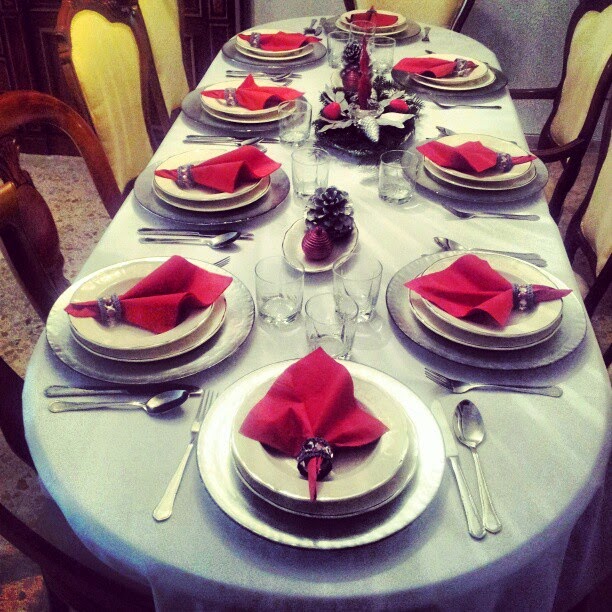
Image resolution: width=612 pixels, height=612 pixels. Find the location of `napkin rings`. napkin rings is located at coordinates (322, 449), (112, 302), (184, 181), (226, 95), (251, 35), (371, 10), (457, 62), (499, 159), (526, 297).